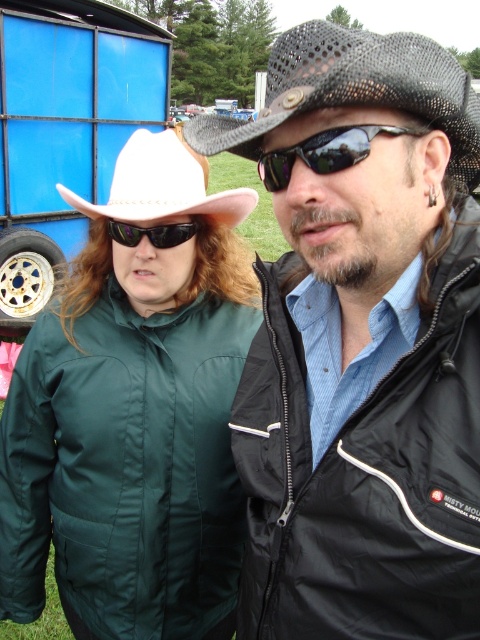
Between green matte jacket at center and sunglasses at center, which one appears on the left side from the viewer's perspective?

From the viewer's perspective, green matte jacket at center appears more on the left side.

Which is above, green matte jacket at center or sunglasses at center?

sunglasses at center

Identify the location of green matte jacket at center. This screenshot has height=640, width=480. (133, 413).

Identify the location of green matte jacket at center. (133, 413).

Is green matte jacket at center positioned at the back of black plastic sunglasses at left?

No, green matte jacket at center is closer to the viewer.

Which is above, green matte jacket at center or black plastic sunglasses at left?

black plastic sunglasses at left is higher up.

Measure the distance between point (74, 324) and camera.

1.94 meters

At what (x,y) coordinates should I click in order to perform the action: click on green matte jacket at center. Please return your answer as a coordinate pair (x, y). The width and height of the screenshot is (480, 640). Looking at the image, I should click on (133, 413).

Who is positioned more to the left, white felt cowboy hat at upper left or sunglasses at center?

Positioned to the left is white felt cowboy hat at upper left.

Is white felt cowboy hat at upper left below sunglasses at center?

No, white felt cowboy hat at upper left is not below sunglasses at center.

Is point (128, 218) farther from camera compared to point (278, 163)?

Yes, it is behind point (278, 163).

The width and height of the screenshot is (480, 640). In order to click on white felt cowboy hat at upper left in this screenshot , I will do click(x=163, y=184).